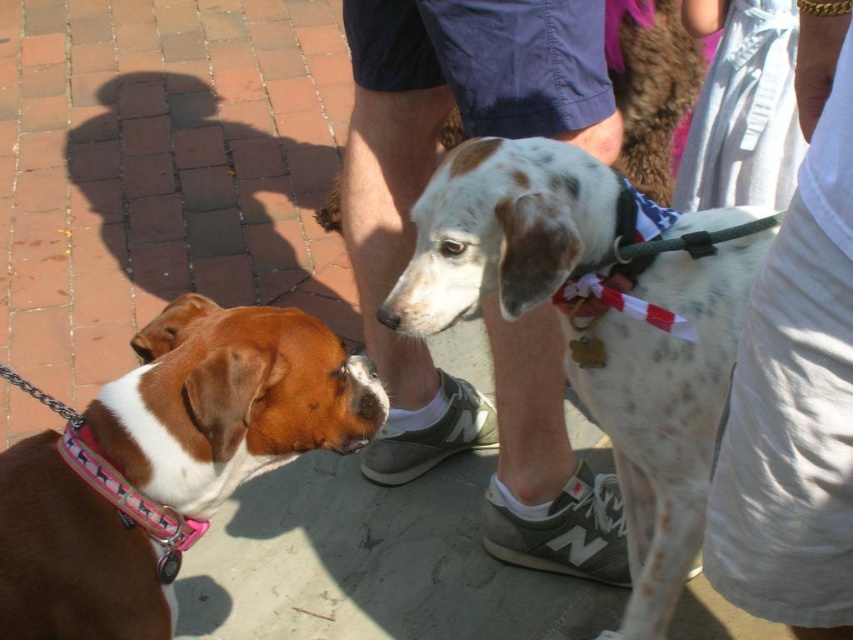
How distant is speckled white dog at center from white cotton shirt at right?

speckled white dog at center is 12.87 inches from white cotton shirt at right.

Between speckled white dog at center and white cotton shirt at right, which one appears on the left side from the viewer's perspective?

Positioned to the left is speckled white dog at center.

What do you see at coordinates (598, 323) in the screenshot?
I see `speckled white dog at center` at bounding box center [598, 323].

At what (x,y) coordinates should I click in order to perform the action: click on speckled white dog at center. Please return your answer as a coordinate pair (x, y). The width and height of the screenshot is (853, 640). Looking at the image, I should click on pos(598,323).

Is point (163, 468) more distant than point (805, 211)?

Yes, it is.

Can you confirm if brown and white fur at left is smaller than white cotton shirt at right?

No.

Identify the location of brown and white fur at left. (166, 468).

Identify the location of brown and white fur at left. Image resolution: width=853 pixels, height=640 pixels. (166, 468).

Can you confirm if speckled white dog at center is bigger than pink fabric neckband at lower left?

Yes.

Can you confirm if speckled white dog at center is smaller than pink fabric neckband at lower left?

No.

This screenshot has width=853, height=640. What do you see at coordinates (598, 323) in the screenshot?
I see `speckled white dog at center` at bounding box center [598, 323].

Find the location of `speckled white dog at center`. speckled white dog at center is located at coordinates (598, 323).